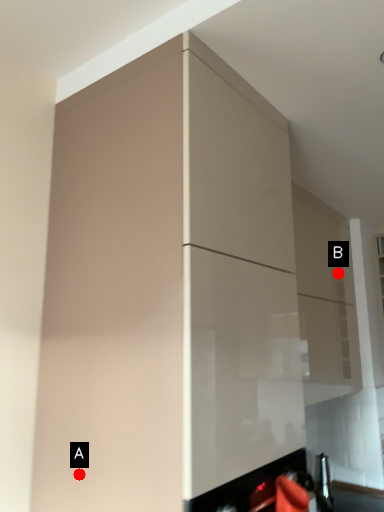
Question: Two points are circled on the image, labeled by A and B beside each circle. Which point is closer to the camera?

Choices:
 (A) A is closer
 (B) B is closer

Answer: (A)